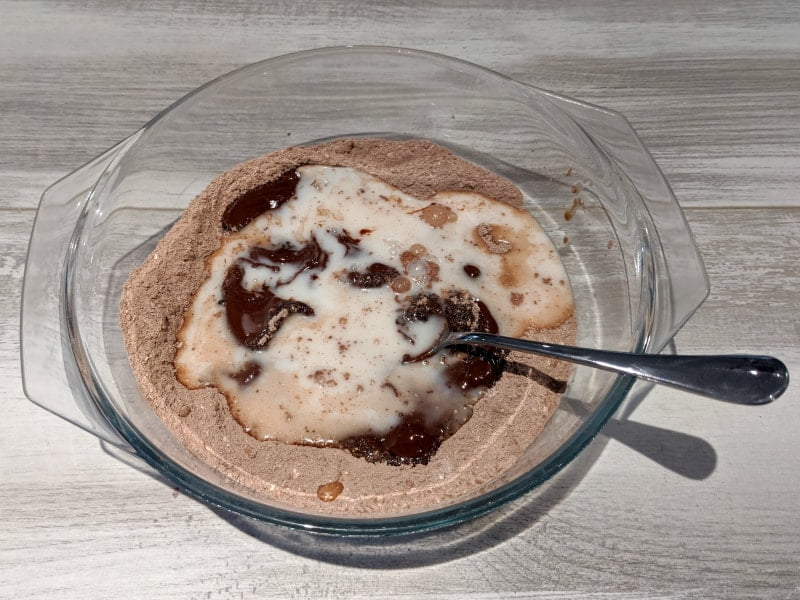
I want to click on bowl shadow, so click(x=593, y=458).